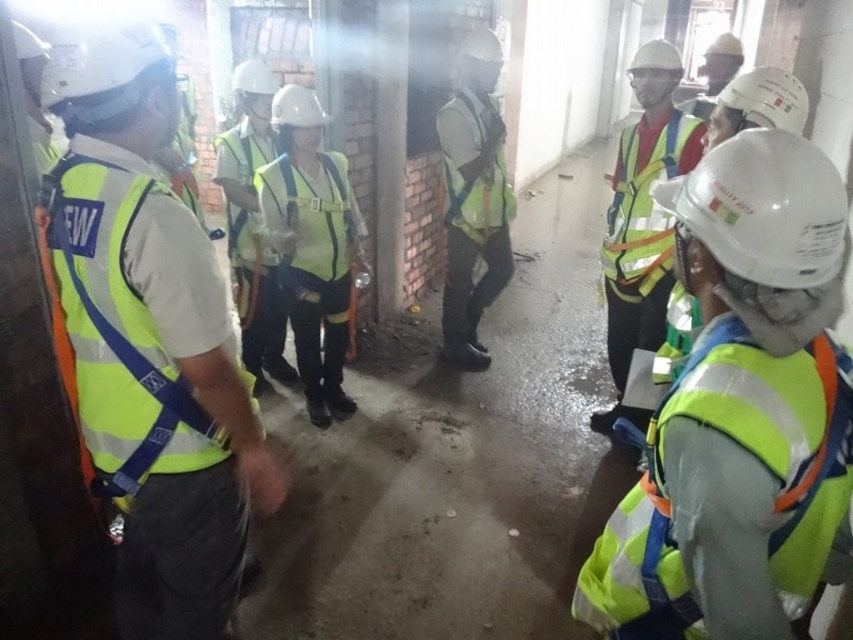
Question: Which of these objects is positioned farthest from the reflective yellow safety vest at right?

Choices:
 (A) yellow reflective vest at center
 (B) high-visibility fabric safety vest at center
 (C) reflective yellow vest at center

Answer: (C)

Question: Is yellow reflective safety vest at center bigger than high-visibility fabric safety vest at center?

Choices:
 (A) yes
 (B) no

Answer: (A)

Question: Is high-visibility yellow vest at center wider than yellow reflective safety vest at center?

Choices:
 (A) no
 (B) yes

Answer: (B)

Question: Estimate the real-world distances between objects in this image. Which object is farther from the high-visibility yellow vest at center?

Choices:
 (A) yellow reflective vest at center
 (B) neon yellow reflective safety vest at left

Answer: (B)

Question: Considering the real-world distances, which object is farthest from the neon yellow reflective vest at left?

Choices:
 (A) high-visibility fabric vest at center
 (B) high-visibility fabric safety vest at center
 (C) reflective yellow vest at center

Answer: (A)

Question: Does reflective yellow safety vest at right appear on the right side of yellow reflective safety vest at center?

Choices:
 (A) no
 (B) yes

Answer: (B)